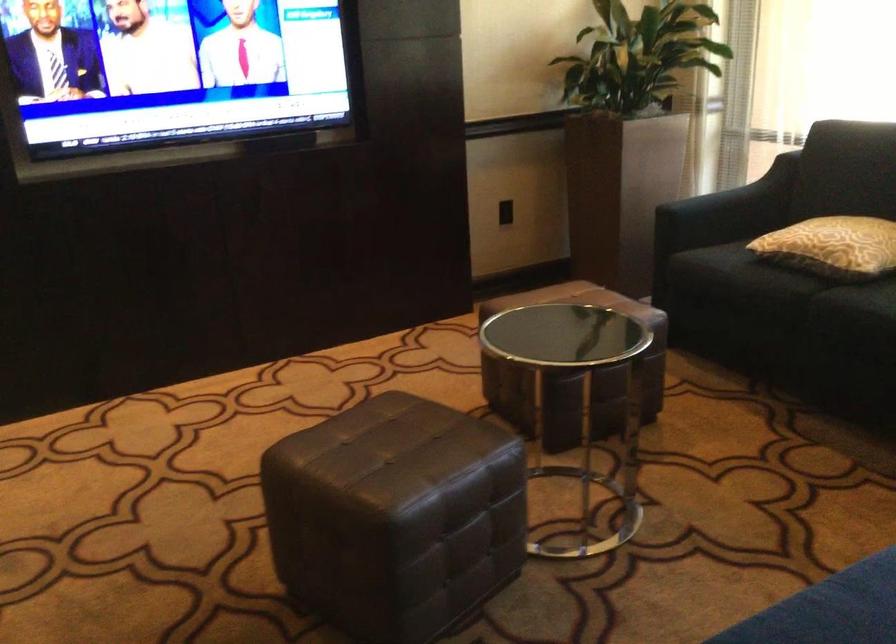
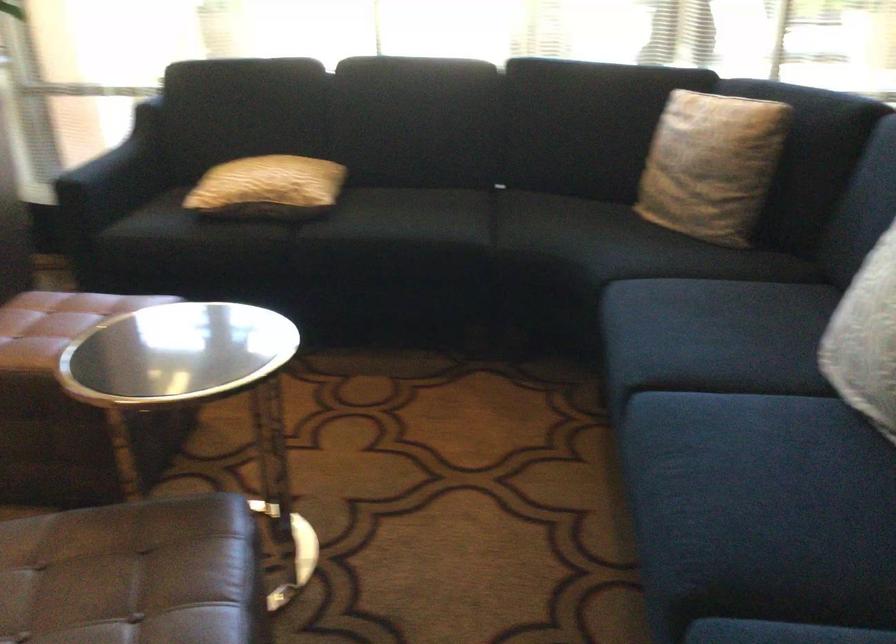
Where in the second image is the point corresponding to the point at 817,242 from the first image?

(268, 187)